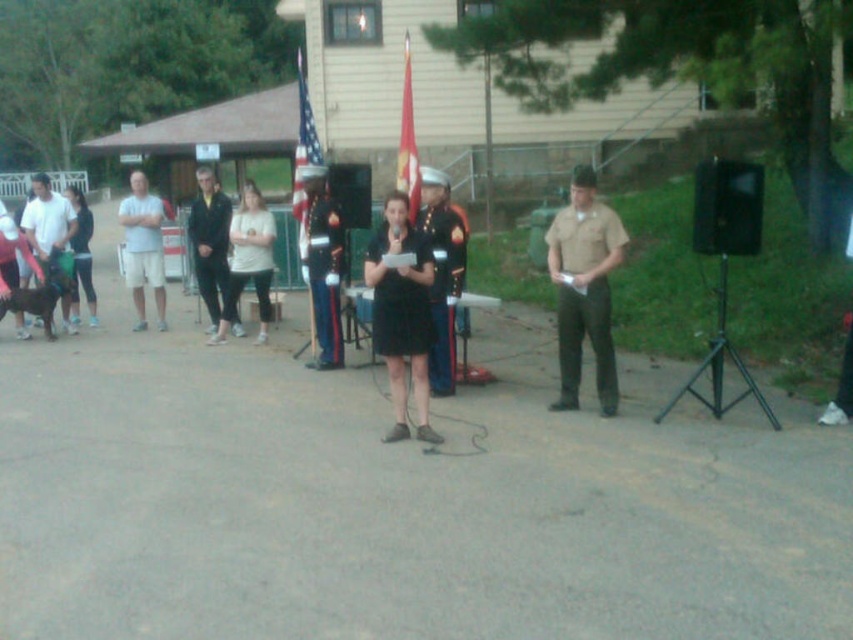
Question: Can you confirm if black fabric pants at left is positioned to the left of matte black uniform at center?

Choices:
 (A) yes
 (B) no

Answer: (A)

Question: Can you confirm if shiny dark blue uniform at center is thinner than black fabric pants at left?

Choices:
 (A) no
 (B) yes

Answer: (B)

Question: Estimate the real-world distances between objects in this image. Which object is closer to the shiny dark blue uniform at center?

Choices:
 (A) black fabric pants at left
 (B) light beige fabric shirt at center
 (C) white cotton shorts at left
 (D) black fabric jacket at upper center

Answer: (B)

Question: Among these points, which one is nearest to the camera?

Choices:
 (A) (161, 280)
 (B) (236, 294)

Answer: (B)

Question: Which point is farther to the camera?

Choices:
 (A) red fabric flag at center
 (B) shiny metallic uniform at center
 (C) light beige fabric shirt at center

Answer: (C)

Question: Is black plastic speaker at right to the right of matte black uniform at center from the viewer's perspective?

Choices:
 (A) no
 (B) yes

Answer: (B)